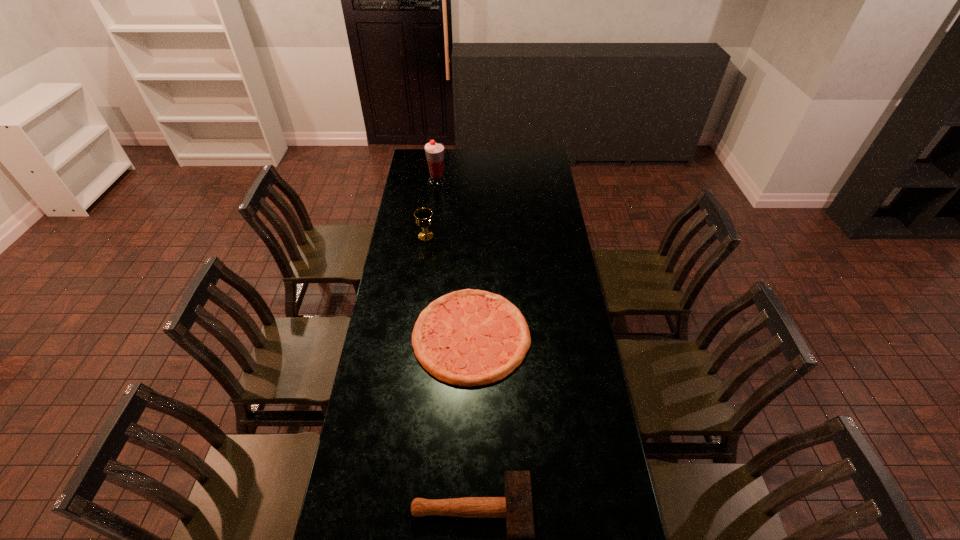
Identify the location of free area in between the farthest object and the chalice. The width and height of the screenshot is (960, 540). (431, 209).

Where is `free spot between the shortest object and the smoothie`? free spot between the shortest object and the smoothie is located at coordinates (454, 259).

Identify the location of unoccupied area between the third nearest object and the farthest object. The height and width of the screenshot is (540, 960). (431, 209).

Select which object appears as the closest to the farthest object. Please provide its 2D coordinates. Your answer should be formatted as a tuple, i.e. [(x, y)], where the tuple contains the x and y coordinates of a point satisfying the conditions above.

[(423, 216)]

Identify which object is located as the third nearest to the third nearest object. Please provide its 2D coordinates. Your answer should be formatted as a tuple, i.e. [(x, y)], where the tuple contains the x and y coordinates of a point satisfying the conditions above.

[(516, 506)]